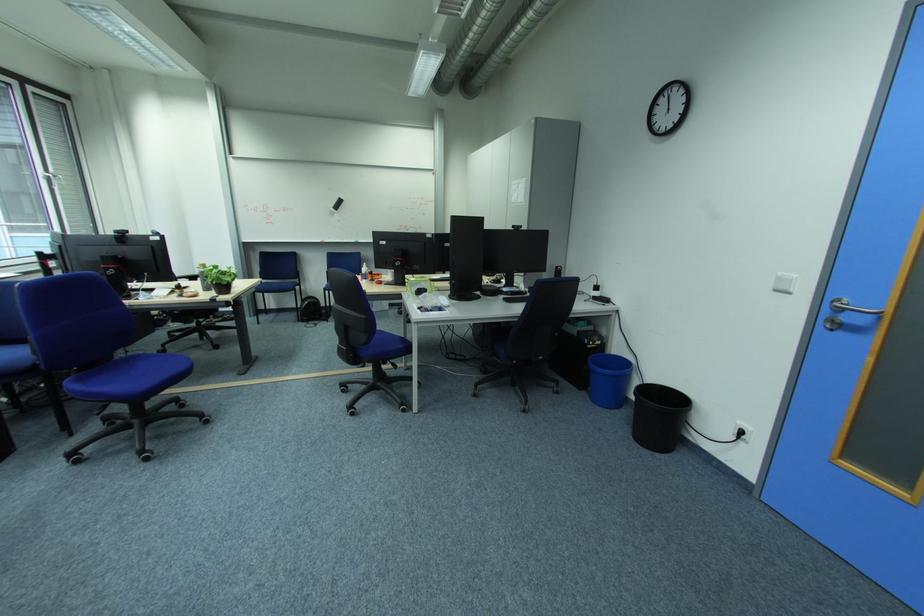
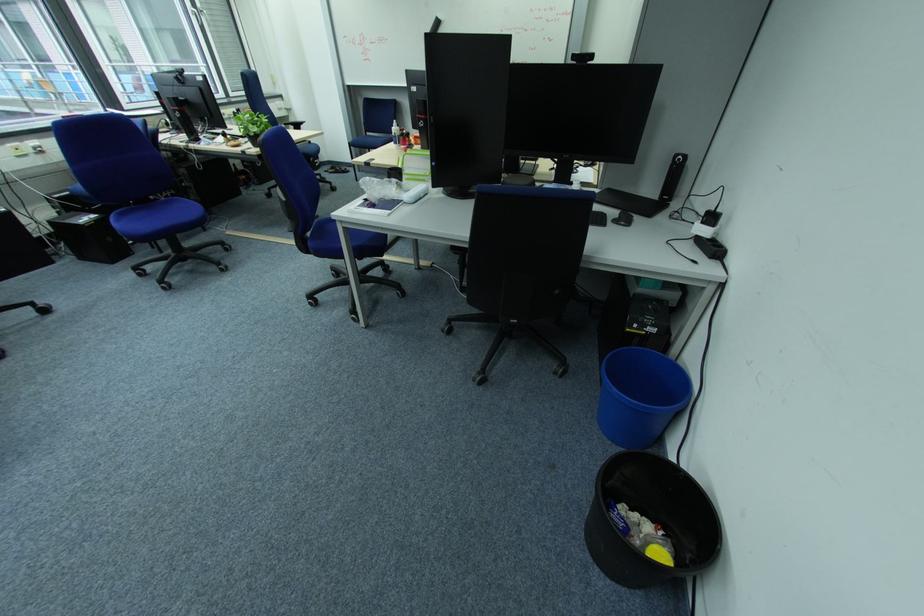
Find the pixel in the second image that matches (x=523, y=228) in the first image.

(581, 57)